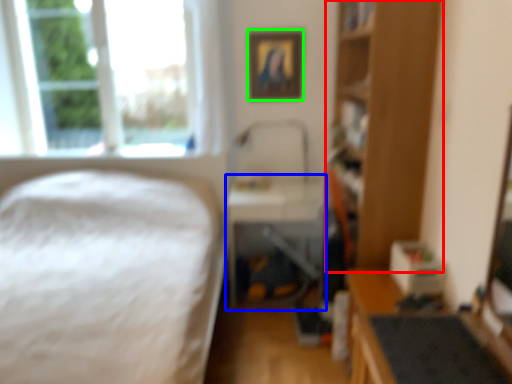
Question: Based on their relative distances, which object is nearer to bookshelf (highlighted by a red box)? Choose from table (highlighted by a blue box) and picture frame (highlighted by a green box).

Choices:
 (A) table
 (B) picture frame

Answer: (A)